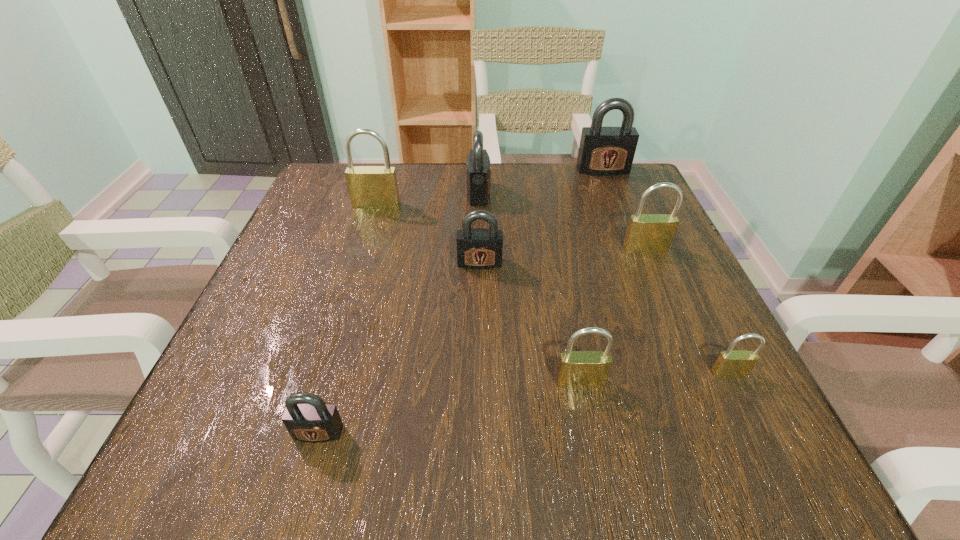
The height and width of the screenshot is (540, 960). What are the coordinates of `the sixth closest object to the third nearest gray padlock` in the screenshot? It's located at (730, 364).

The height and width of the screenshot is (540, 960). Identify the location of object that is the second closest one to the smallest brass padlock. (646, 233).

Where is `the third closest padlock to the fourth padlock from right to left`? This screenshot has height=540, width=960. the third closest padlock to the fourth padlock from right to left is located at coordinates (646, 233).

Locate which padlock ranks fifth in proximity to the leftmost gray padlock. Please provide its 2D coordinates. Your answer should be formatted as a tuple, i.e. [(x, y)], where the tuple contains the x and y coordinates of a point satisfying the conditions above.

[(478, 169)]

Point out which gray padlock is positioned as the second nearest to the leftmost brass padlock. Please provide its 2D coordinates. Your answer should be formatted as a tuple, i.e. [(x, y)], where the tuple contains the x and y coordinates of a point satisfying the conditions above.

[(479, 248)]

Image resolution: width=960 pixels, height=540 pixels. In order to click on gray padlock that stands as the third closest to the leftmost gray padlock in this screenshot , I will do `click(604, 151)`.

The height and width of the screenshot is (540, 960). What are the coordinates of `the fourth closest brass padlock relative to the third smallest gray padlock` in the screenshot? It's located at (730, 364).

Where is `brass padlock that is the fourth closest to the farthest gray padlock`? brass padlock that is the fourth closest to the farthest gray padlock is located at coordinates (577, 369).

Find the location of a particular element. The image size is (960, 540). free space in the image that satisfies the following two spatial constraints: 1. on the front of the third nearest gray padlock near the keyhole; 2. on the front of the nearest object near the keyhole is located at coordinates (478, 433).